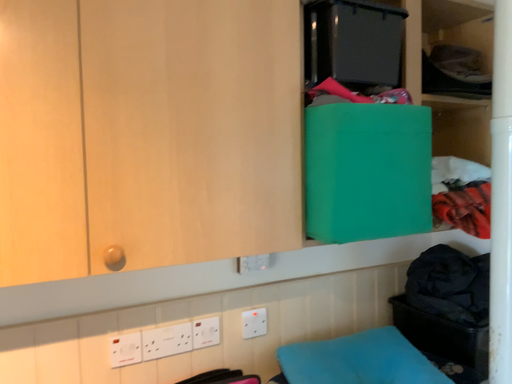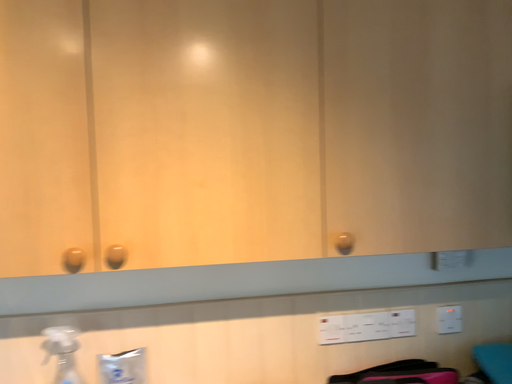
Question: How did the camera likely rotate when shooting the video?

Choices:
 (A) rotated right
 (B) rotated left

Answer: (B)